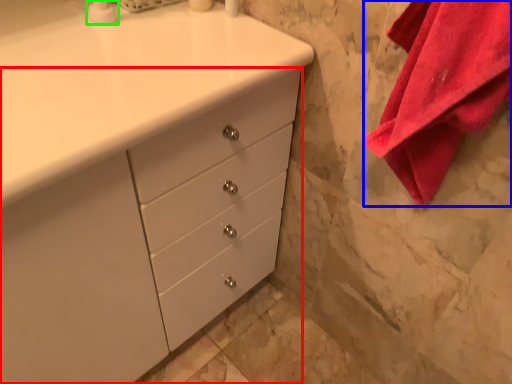
Question: Considering the real-world distances, which object is farthest from chest of drawers (highlighted by a red box)? bath towel (highlighted by a blue box) or soap dispenser (highlighted by a green box)?

Choices:
 (A) bath towel
 (B) soap dispenser

Answer: (B)